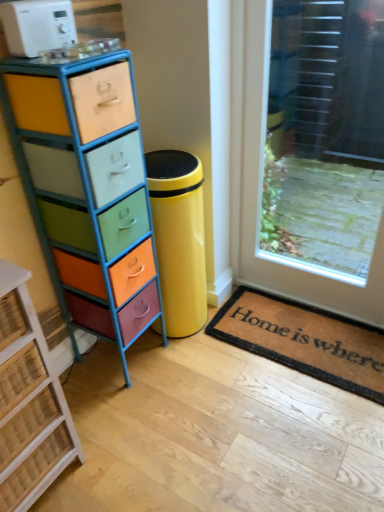
Where is `blank space situated above brown coir mat at lower right (from a real-world perspective)`? blank space situated above brown coir mat at lower right (from a real-world perspective) is located at coordinates (295, 333).